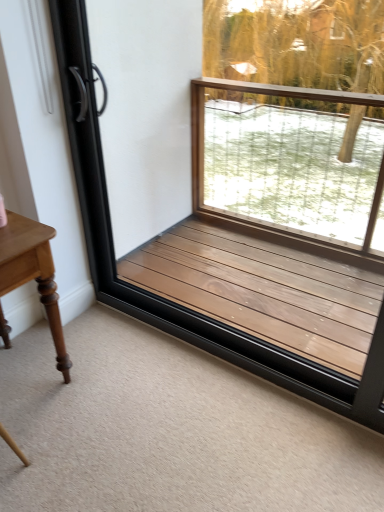
Question: In terms of width, does brown wood window frame at center look wider or thinner when compared to light brown wood table at left?

Choices:
 (A) thin
 (B) wide

Answer: (A)

Question: Is point (203, 348) closer or farther from the camera than point (11, 285)?

Choices:
 (A) closer
 (B) farther

Answer: (B)

Question: Based on their sizes in the image, would you say brown wood window frame at center is bigger or smaller than light brown wood table at left?

Choices:
 (A) big
 (B) small

Answer: (A)

Question: Is light brown wood table at left spatially inside brown wood window frame at center, or outside of it?

Choices:
 (A) outside
 (B) inside

Answer: (A)

Question: Is light brown wood table at left in front of or behind brown wood window frame at center in the image?

Choices:
 (A) front
 (B) behind

Answer: (B)

Question: From the image's perspective, relative to brown wood window frame at center, is light brown wood table at left above or below?

Choices:
 (A) above
 (B) below

Answer: (B)

Question: In the image, is light brown wood table at left on the left side or the right side of brown wood window frame at center?

Choices:
 (A) right
 (B) left

Answer: (B)